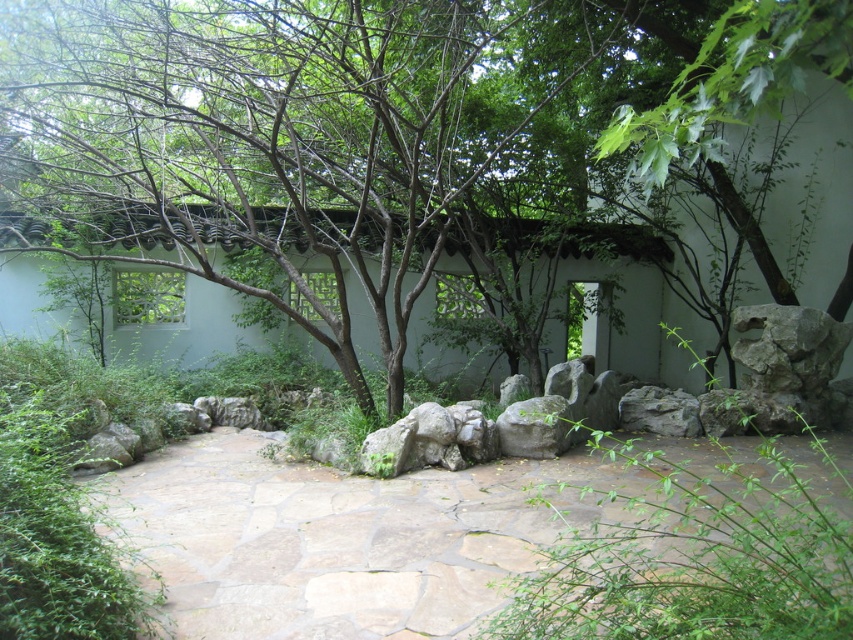
You are standing at the entrance of the garden and see two points marked in the image. The first point is at coordinate point (196, 499) and the second is at point (770, 360). Which point is closer to you as you face the garden?

Point (196, 499) is in front of point (770, 360), so it is closer to you as you face the garden.

You are a gardener planning to place a new decorative plant between the gray rough rock at right and the gray rough stone at center. Based on their positions, which object should the plant be placed closer to in order to maintain balance in the garden layout?

The gray rough rock at right is located above the gray rough stone at center, so placing the plant closer to the gray rough stone at center would help balance the composition by counteracting the upward position of the rock.